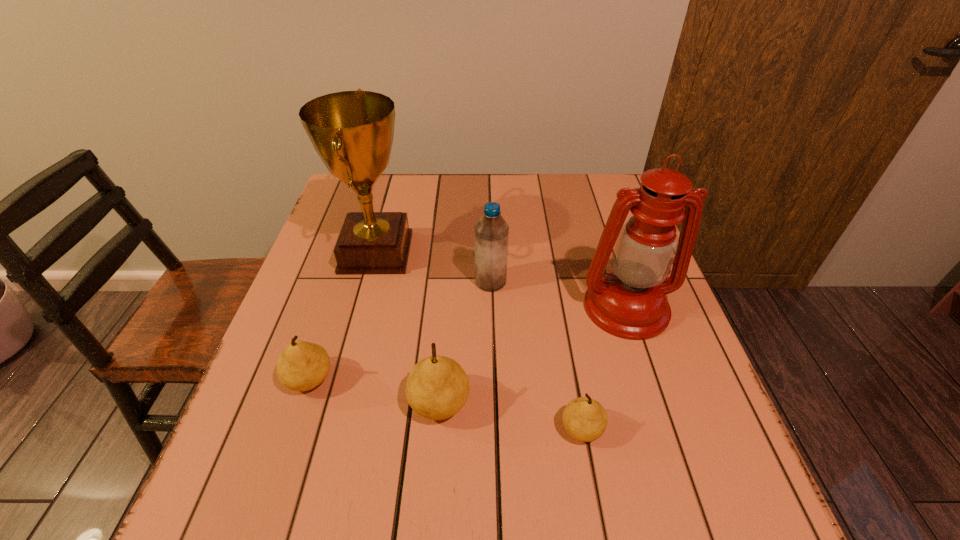
In the image, there is a desktop. Identify the location of free space at the near edge. The height and width of the screenshot is (540, 960). [421, 428].

Locate an element on the screen. free space at the right edge of the desktop is located at coordinates (651, 403).

This screenshot has height=540, width=960. In the image, there is a desktop. Find the location of `free space at the far left corner`. free space at the far left corner is located at coordinates (384, 183).

The height and width of the screenshot is (540, 960). In the image, there is a desktop. What are the coordinates of `vacant space at the far right corner` in the screenshot? It's located at (601, 200).

Locate an element on the screen. vacant space that is in between the award and the third object from left to right is located at coordinates (408, 328).

I want to click on free point between the second shortest pear and the rightmost object, so click(468, 343).

At what (x,y) coordinates should I click in order to perform the action: click on vacant space that's between the award and the shortest pear. Please return your answer as a coordinate pair (x, y). This screenshot has height=540, width=960. Looking at the image, I should click on (479, 341).

Where is `vacant space that is in between the second pear from left to right and the third tallest object`? The width and height of the screenshot is (960, 540). vacant space that is in between the second pear from left to right and the third tallest object is located at coordinates (465, 342).

Locate an element on the screen. vacant area between the third shortest object and the third object from right to left is located at coordinates (465, 342).

You are a GUI agent. You are given a task and a screenshot of the screen. Output one action in this format:
    pyautogui.click(x=<x>, y=<y>)
    Task: Click on the free area in between the second pear from right to left and the award
    Image resolution: width=960 pixels, height=540 pixels.
    Given the screenshot: What is the action you would take?
    pyautogui.click(x=408, y=328)